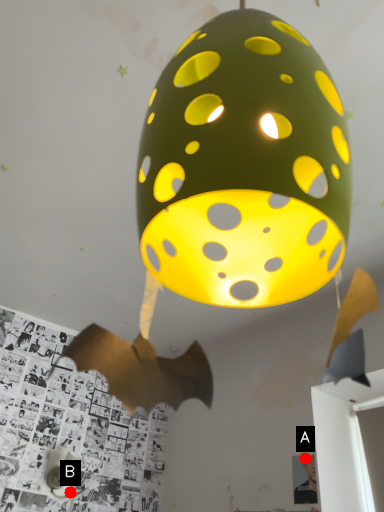
Question: Two points are circled on the image, labeled by A and B beside each circle. Which point appears farthest from the camera in this image?

Choices:
 (A) A is further
 (B) B is further

Answer: (B)